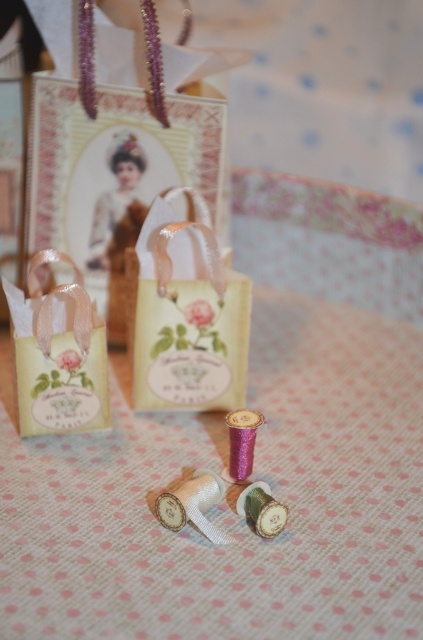
Who is more distant from viewer, (98, 566) or (225, 349)?

Point (225, 349)

Which is more to the right, pink dotted fabric at center or matte paper bag at center?

Positioned to the right is matte paper bag at center.

Is point (368, 384) positioned after point (145, 243)?

That is True.

Where is `pink dotted fabric at center`? Image resolution: width=423 pixels, height=640 pixels. pink dotted fabric at center is located at coordinates (225, 504).

Is pink dotted fabric at center further to camera compared to matte paper bag at left?

No.

Which is in front, point (354, 486) or point (52, 387)?

Positioned in front is point (354, 486).

This screenshot has height=640, width=423. Find the location of `pink dotted fabric at center`. pink dotted fabric at center is located at coordinates (225, 504).

At what (x,y) coordinates should I click in order to perform the action: click on matte paper bag at center. Please return your answer as a coordinate pair (x, y). Looking at the image, I should click on (187, 314).

Consider the image. Can you confirm if matte paper bag at center is positioned to the right of matte paper bag at left?

Indeed, matte paper bag at center is positioned on the right side of matte paper bag at left.

Is point (214, 358) positioned in front of point (106, 380)?

No, it is not.

Where is `matte paper bag at center`? matte paper bag at center is located at coordinates (187, 314).